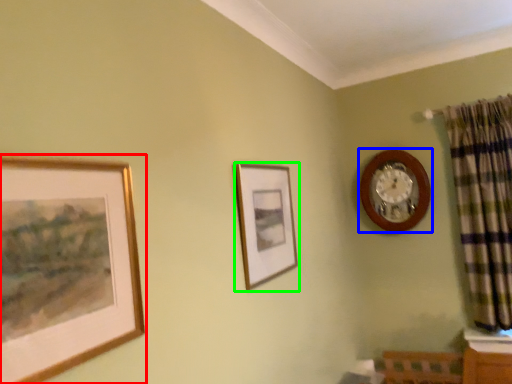
Question: Based on their relative distances, which object is farther from picture frame (highlighted by a red box)? Choose from wall clock (highlighted by a blue box) and picture frame (highlighted by a green box).

Choices:
 (A) wall clock
 (B) picture frame

Answer: (A)